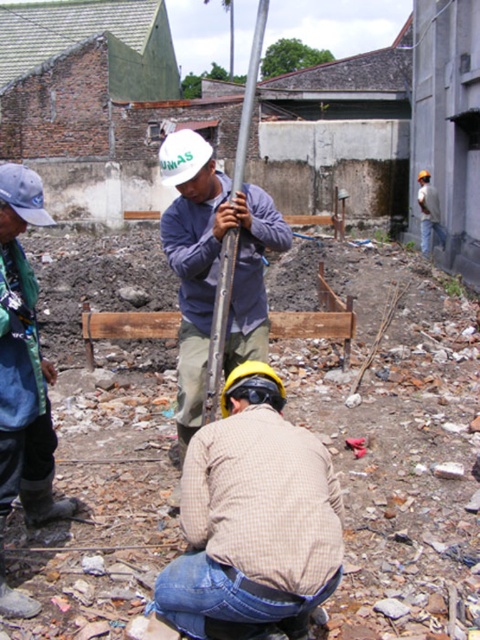
Measure the distance between matte white helmet at center and light gray concrete worker at upper right.

matte white helmet at center is 10.31 meters from light gray concrete worker at upper right.

Between matte white helmet at center and light gray concrete worker at upper right, which one appears on the left side from the viewer's perspective?

matte white helmet at center

Image resolution: width=480 pixels, height=640 pixels. In order to click on matte white helmet at center in this screenshot , I will do `click(214, 266)`.

Image resolution: width=480 pixels, height=640 pixels. What do you see at coordinates (253, 515) in the screenshot?
I see `checkered fabric shirt at center` at bounding box center [253, 515].

Can you confirm if checkered fabric shirt at center is wider than blue fabric cap at upper left?

No, checkered fabric shirt at center is not wider than blue fabric cap at upper left.

The image size is (480, 640). What do you see at coordinates (253, 515) in the screenshot?
I see `checkered fabric shirt at center` at bounding box center [253, 515].

Locate an element on the screen. The image size is (480, 640). checkered fabric shirt at center is located at coordinates (253, 515).

Who is lower down, white matte hardhat at center or blue fabric cap at upper left?

blue fabric cap at upper left is below.

Is white matte hardhat at center below blue fabric cap at upper left?

Result: No.

Between point (190, 172) and point (31, 182), which one is positioned in front?

Point (31, 182) is in front.

Locate an element on the screen. Image resolution: width=480 pixels, height=640 pixels. white matte hardhat at center is located at coordinates (182, 156).